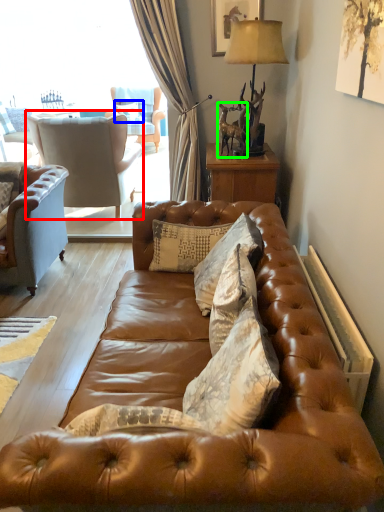
Question: Which object is the closest to the chair (highlighted by a red box)? Choose among these: pillow (highlighted by a blue box) or animal (highlighted by a green box).

Choices:
 (A) pillow
 (B) animal

Answer: (B)